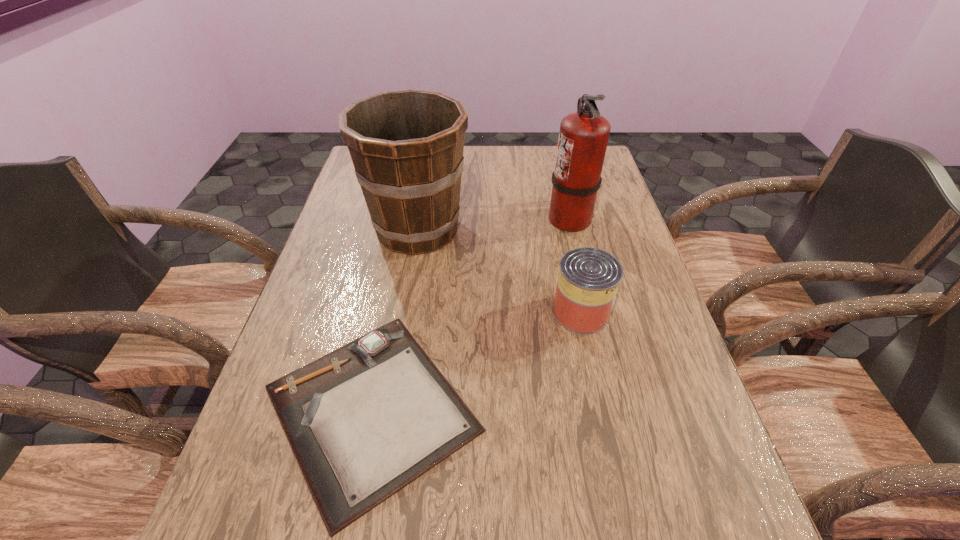
Find the location of `unoccupied position between the clipboard and the fire extinguisher`. unoccupied position between the clipboard and the fire extinguisher is located at coordinates (470, 314).

You are a GUI agent. You are given a task and a screenshot of the screen. Output one action in this format:
    pyautogui.click(x=<x>, y=<y>)
    Task: Click on the blank region between the bucket and the fire extinguisher
    
    Given the screenshot: What is the action you would take?
    pyautogui.click(x=493, y=224)

The height and width of the screenshot is (540, 960). Identify the location of free space between the fire extinguisher and the shortest object. (470, 314).

Where is `free space between the shortest object and the third tallest object`? Image resolution: width=960 pixels, height=540 pixels. free space between the shortest object and the third tallest object is located at coordinates (476, 360).

At what (x,y) coordinates should I click in order to perform the action: click on free space between the bucket and the shortest object. Please return your answer as a coordinate pair (x, y). This screenshot has width=960, height=540. Looking at the image, I should click on (395, 319).

Image resolution: width=960 pixels, height=540 pixels. Find the location of `object that is the second closest one to the shortest object`. object that is the second closest one to the shortest object is located at coordinates (407, 146).

The image size is (960, 540). I want to click on the third closest object to the third shortest object, so click(583, 137).

Identify the location of blank space that satisfies the following two spatial constraints: 1. on the front side of the third tallest object; 2. on the right side of the bucket. This screenshot has height=540, width=960. (404, 312).

At what (x,y) coordinates should I click in order to perform the action: click on free space that satisfies the following two spatial constraints: 1. toward the nozzle of the fire extinguisher; 2. on the front side of the shortest object. Please return your answer as a coordinate pair (x, y). This screenshot has height=540, width=960. Looking at the image, I should click on tap(616, 409).